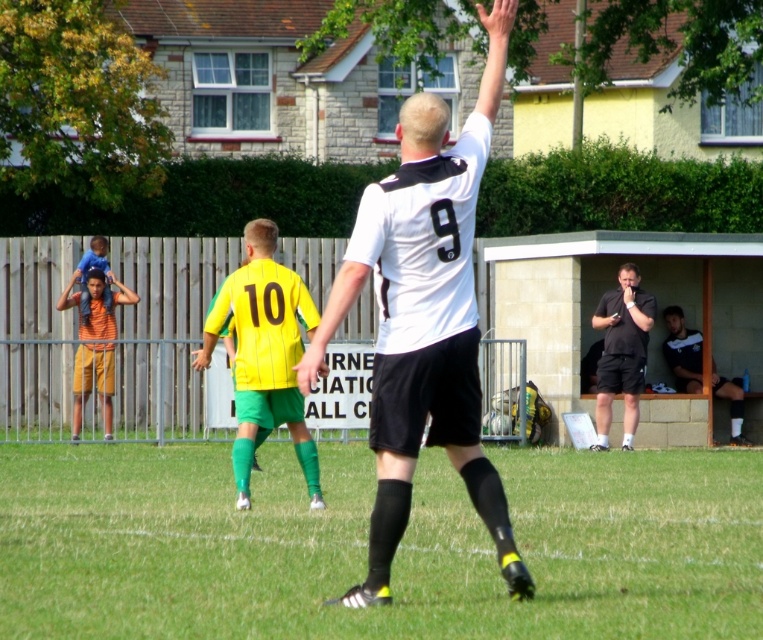
Question: Is green grass at center behind blue fabric boy at left?

Choices:
 (A) yes
 (B) no

Answer: (B)

Question: Which object appears closest to the camera in this image?

Choices:
 (A) orange cotton shorts at left
 (B) green grass at center
 (C) yellow-green jersey at center
 (D) white matte jersey at center

Answer: (B)

Question: Is black matte shirt at right further to the viewer compared to black jersey at right?

Choices:
 (A) yes
 (B) no

Answer: (B)

Question: Which point appears closest to the camera in this image?

Choices:
 (A) (604, 429)
 (B) (105, 305)
 (C) (102, 400)
 (D) (733, 490)

Answer: (D)

Question: Which object is closer to the camera taking this photo?

Choices:
 (A) black jersey at right
 (B) green grass at center

Answer: (B)

Question: Does yellow-green jersey at center have a smaller size compared to black jersey at right?

Choices:
 (A) yes
 (B) no

Answer: (A)